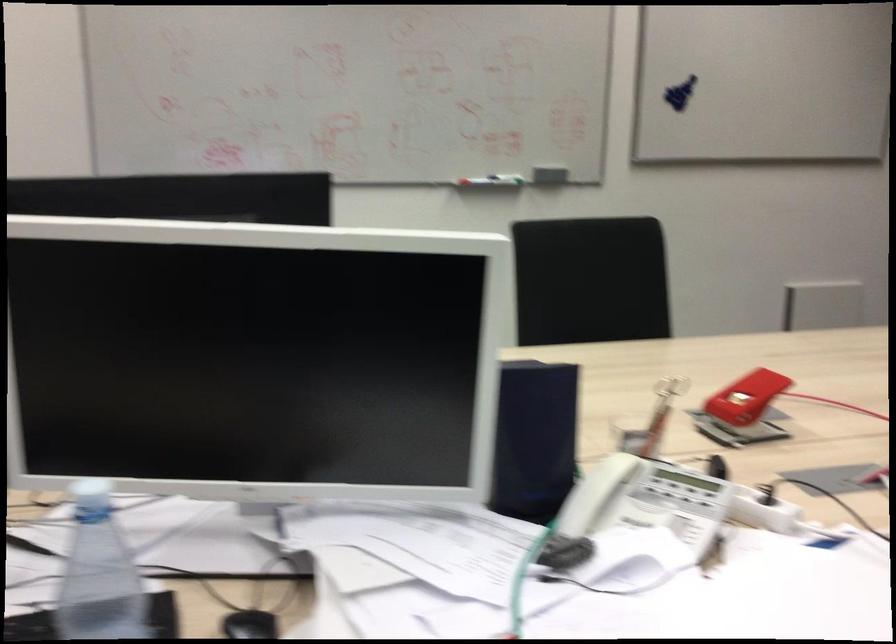
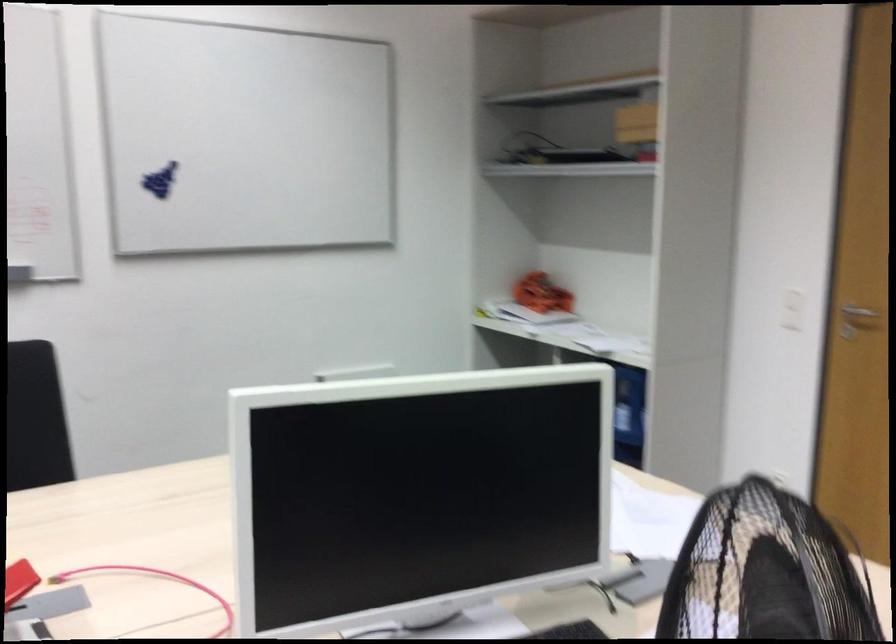
Question: The images are taken continuously from a first-person perspective. In which direction are you moving?

Choices:
 (A) Left
 (B) Right
 (C) Forward
 (D) Backward

Answer: (B)